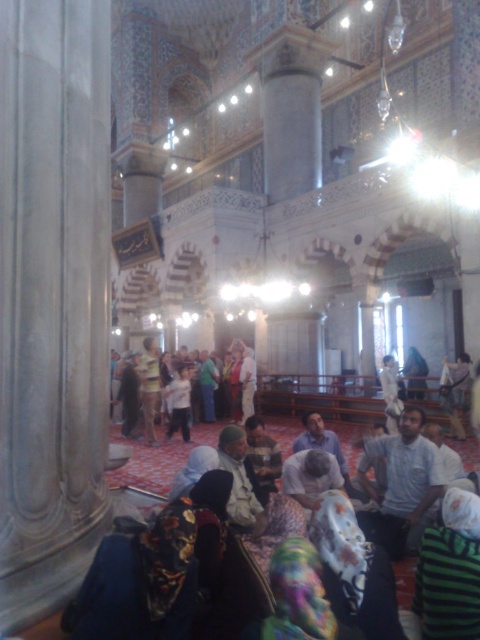
You are standing in the grand mosque and notice two points marked in the scene. The first point is at coordinates point (409, 512) and the second is at point (238, 346). Which of these points is closer to your current position?

Point (409, 512) is closer to the camera than point (238, 346), so it is closer to your current position.

You are standing in the grand mosque and notice two people in the foreground wearing a light gray shirt at center and a light brown leather jacket at center. Which clothing item is shorter in height?

The light gray shirt at center is shorter in height than the light brown leather jacket at center.

You are a photographer planning to capture a group photo of the two people in the center of the mosque. Given that you want to ensure both the light gray shirt at center and the light brown leather jacket at center are clearly visible, which person should you position closer to the camera to avoid blurring due to their clothing size?

The light gray shirt at center is narrower than the light brown leather jacket at center. To prevent blurring, position the person wearing the light gray shirt at center closer to the camera since their clothing is smaller and requires less focus distance.